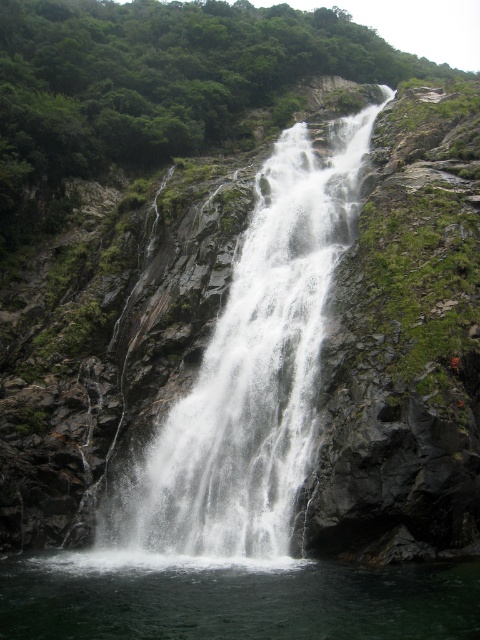
You are a drone operator trying to capture the waterfall from above. The white frothy water at center is your main subject. Where should you position the drone to ensure it is centered in your shot?

Position the drone at the coordinates point (250,372) to center the white frothy water at center in your shot.

You are a drone operator trying to capture the waterfall in the image. You need to fly your drone between the white frothy water at center and the clear water at center. What is the minimum distance your drone must be able to fly to pass between them?

The white frothy water at center and clear water at center are 9.31 meters apart from each other. Therefore, the minimum distance your drone must be able to fly to pass between them is 9.31 meters.

You are a photographer standing at the base of the waterfall. You want to capture a shot that includes both the white frothy water at center and the clear water at center. Which direction should you move to ensure both elements are in frame?

You should move to the left so that both the white frothy water at center and the clear water at center are visible in your frame, as the white frothy water at center is to the right of the clear water at center.